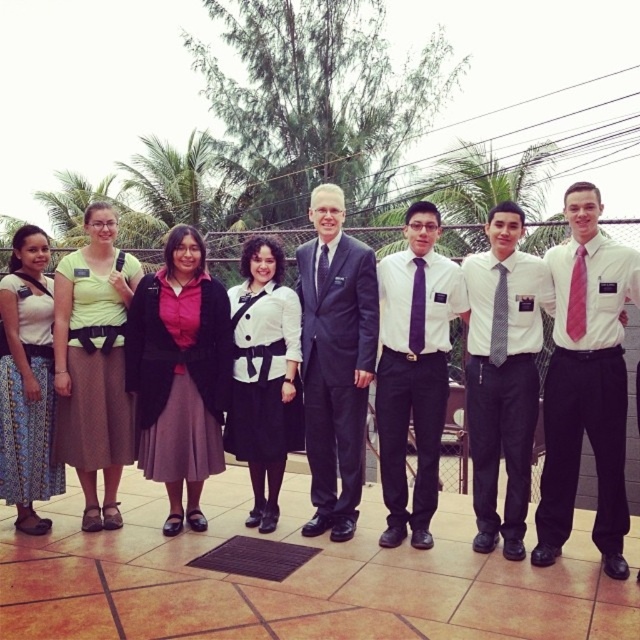
What object is located at the coordinates point (93, 364) in the image?

The point (93, 364) corresponds to the matte yellow green shirt at center.

You are a photographer trying to capture a clear shot of the two individuals wearing ties at the center of the group. Given that the white shirt with tie at center is larger in size than the pink silk tie at center, which tie should you focus on to ensure it is visible in the photo?

You should focus on the white shirt with tie at center because it is larger in size than the pink silk tie at center, making it more visible in the photo.